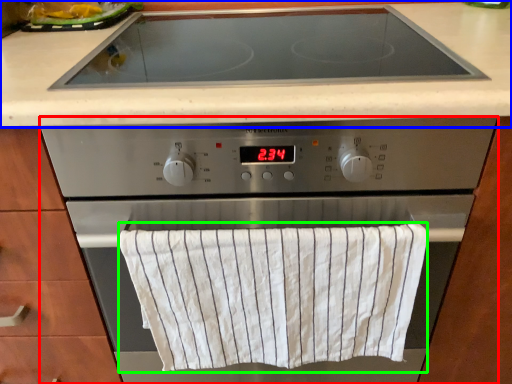
Question: Which object is positioned farthest from home appliance (highlighted by a red box)? Select from countertop (highlighted by a blue box) and bath towel (highlighted by a green box).

Choices:
 (A) countertop
 (B) bath towel

Answer: (A)